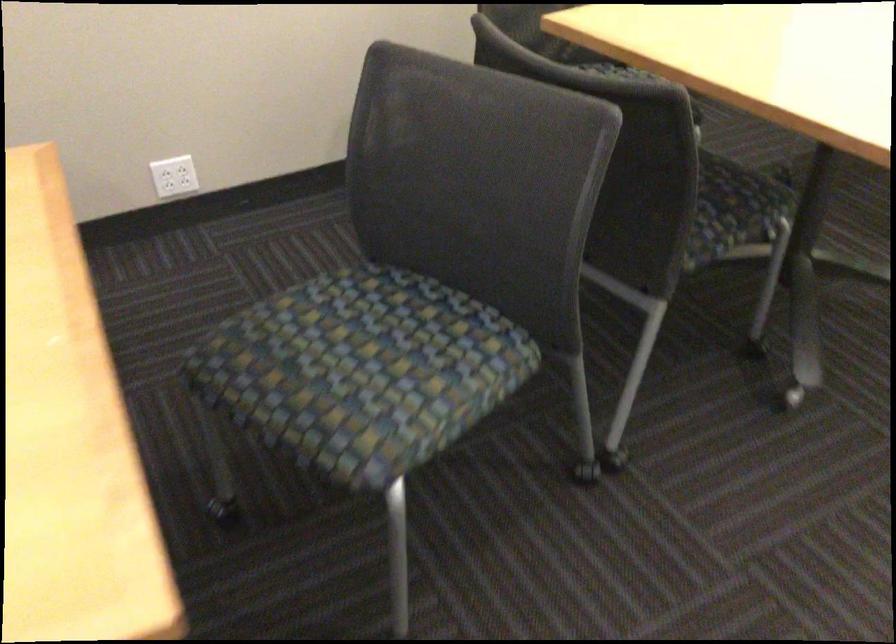
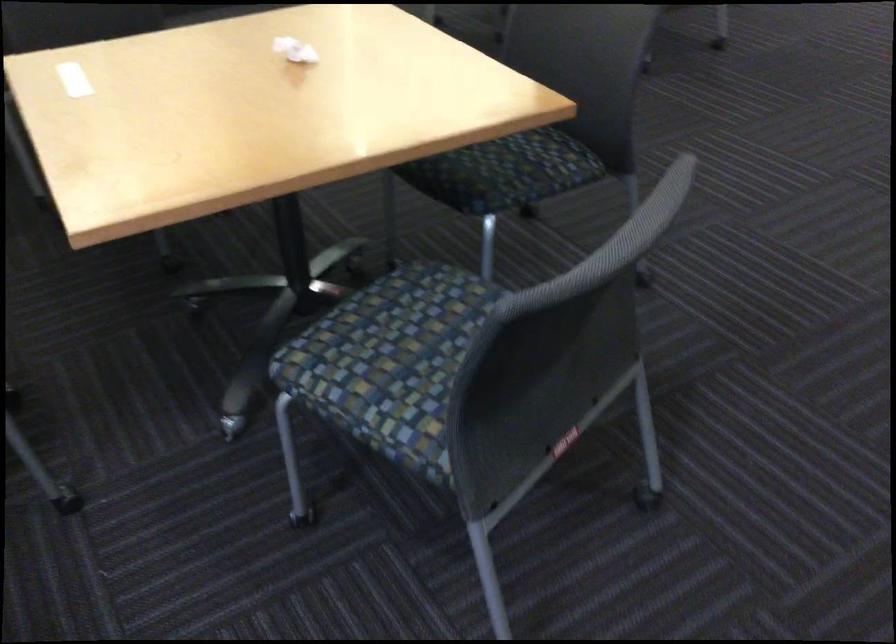
Question: I am providing you with two images of the same scene from different viewpoints. Please identify which objects are invisible in image2.

Choices:
 (A) crumpled white paper
 (B) patterned chair sitting surface
 (C) chair sitting surface
 (D) mobile whiteboard

Answer: (B)